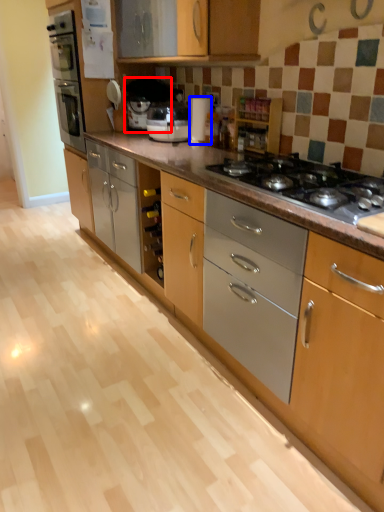
Question: Which point is closer to the camera, coffee machine (highlighted by a red box) or appliance (highlighted by a blue box)?

Choices:
 (A) coffee machine
 (B) appliance

Answer: (B)